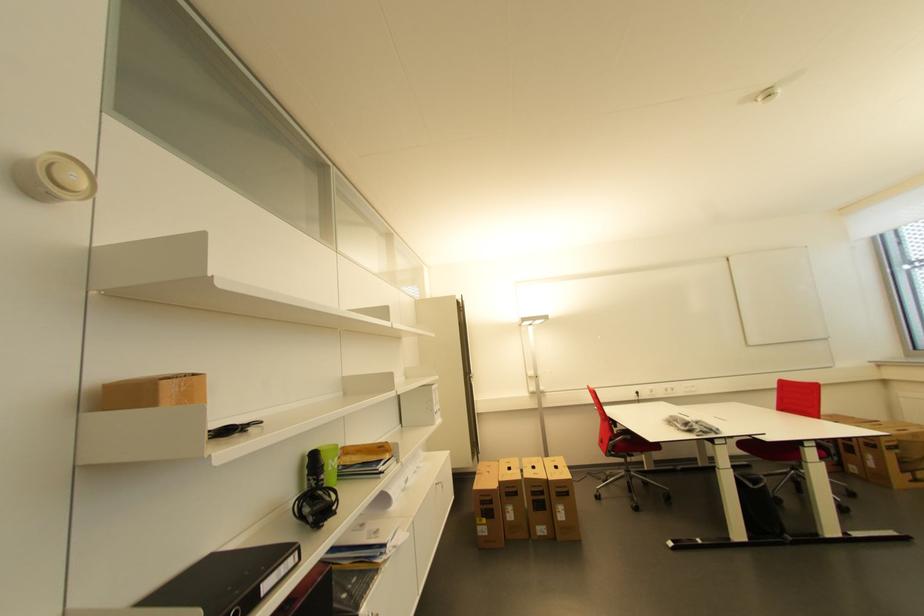
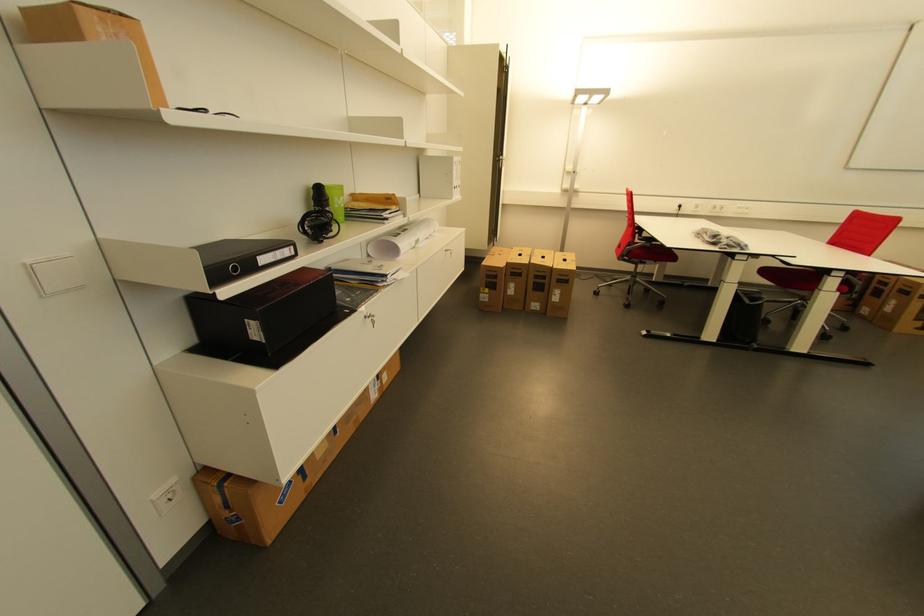
The point at (327, 459) is marked in the first image. Where is the corresponding point in the second image?

(333, 193)